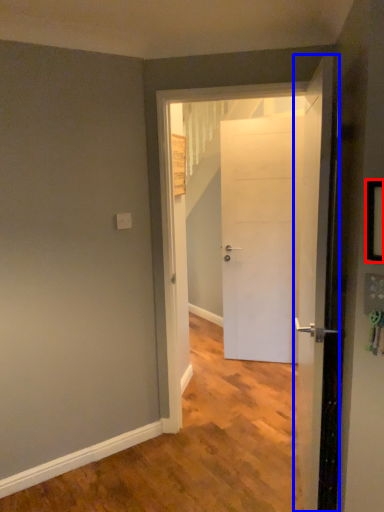
Question: Which of the following is the farthest to the observer, picture frame (highlighted by a red box) or door (highlighted by a blue box)?

Choices:
 (A) picture frame
 (B) door

Answer: (B)